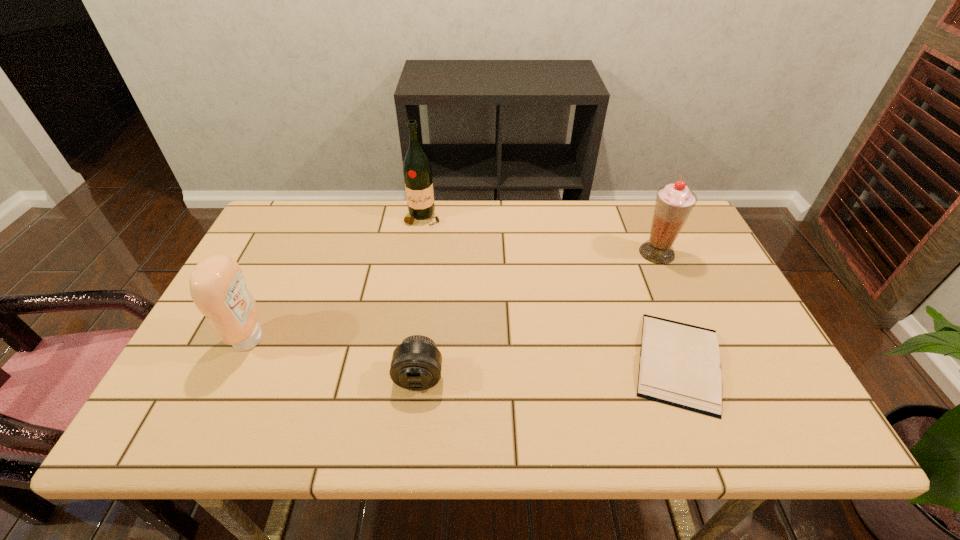
Locate an element on the screen. vacant space that satisfies the following two spatial constraints: 1. on the label of the leftmost object; 2. on the back side of the hardback book is located at coordinates (238, 362).

Locate an element on the screen. This screenshot has width=960, height=540. free region that satisfies the following two spatial constraints: 1. on the surface of the tallest object; 2. on the label of the condiment is located at coordinates (404, 339).

Identify the location of free spot that satisfies the following two spatial constraints: 1. on the surface of the shortest object; 2. on the right side of the tallest object. (400, 362).